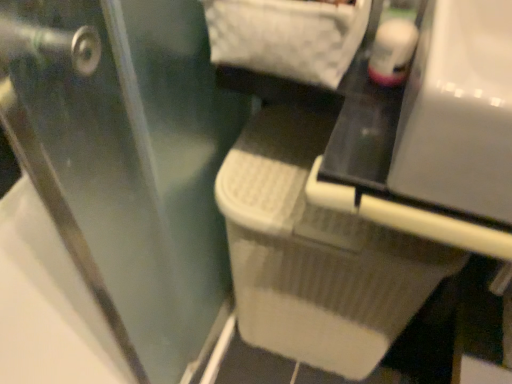
Question: Is white textured laundry basket at center taller than white plastic vanity at center?

Choices:
 (A) no
 (B) yes

Answer: (B)

Question: Does white textured laundry basket at center have a greater width compared to white plastic vanity at center?

Choices:
 (A) yes
 (B) no

Answer: (B)

Question: Is white textured laundry basket at center bigger than white plastic vanity at center?

Choices:
 (A) yes
 (B) no

Answer: (A)

Question: From a real-world perspective, is white textured laundry basket at center located higher than white plastic vanity at center?

Choices:
 (A) yes
 (B) no

Answer: (B)

Question: From the image's perspective, would you say white textured laundry basket at center is shown under white plastic vanity at center?

Choices:
 (A) yes
 (B) no

Answer: (A)

Question: Is white textured laundry basket at center positioned beyond the bounds of white plastic vanity at center?

Choices:
 (A) no
 (B) yes

Answer: (B)

Question: Is white plastic vanity at center completely or partially inside transparent plastic screen door at lower right?

Choices:
 (A) yes
 (B) no

Answer: (B)

Question: Can you see transparent plastic screen door at lower right touching white plastic vanity at center?

Choices:
 (A) no
 (B) yes

Answer: (A)

Question: From the image's perspective, is transparent plastic screen door at lower right under white plastic vanity at center?

Choices:
 (A) no
 (B) yes

Answer: (B)

Question: Is white plastic vanity at center at the back of transparent plastic screen door at lower right?

Choices:
 (A) yes
 (B) no

Answer: (A)

Question: Considering the relative sizes of transparent plastic screen door at lower right and white plastic vanity at center in the image provided, is transparent plastic screen door at lower right shorter than white plastic vanity at center?

Choices:
 (A) yes
 (B) no

Answer: (B)

Question: Is transparent plastic screen door at lower right wider than white plastic vanity at center?

Choices:
 (A) no
 (B) yes

Answer: (A)

Question: From a real-world perspective, is white plastic vanity at center over transparent plastic screen door at lower right?

Choices:
 (A) yes
 (B) no

Answer: (A)